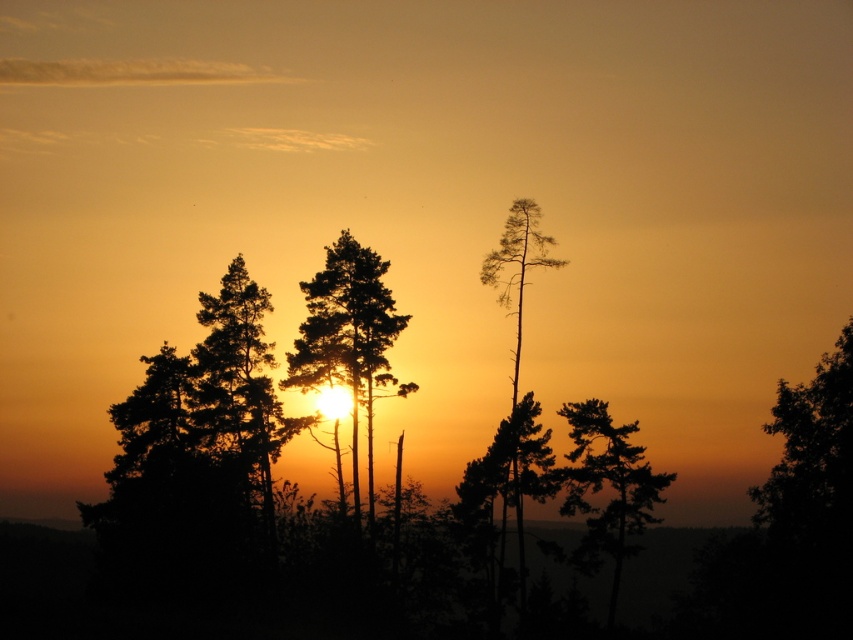
Question: Is silhouette tree at center positioned behind silhouette wood at right?

Choices:
 (A) no
 (B) yes

Answer: (B)

Question: Which point is farther from the camera taking this photo?

Choices:
 (A) (549, 268)
 (B) (323, 275)

Answer: (A)

Question: Can you confirm if dark green leafy tree at right is positioned above silhouette wood at right?

Choices:
 (A) yes
 (B) no

Answer: (B)

Question: Which point is closer to the camera?

Choices:
 (A) (347, 257)
 (B) (780, 541)
 (C) (547, 244)

Answer: (B)

Question: Which object appears farthest from the camera in this image?

Choices:
 (A) silhouette wood at right
 (B) dark green leafy tree at right

Answer: (A)

Question: Does silhouette tree at center lie in front of silhouette wood at right?

Choices:
 (A) no
 (B) yes

Answer: (A)